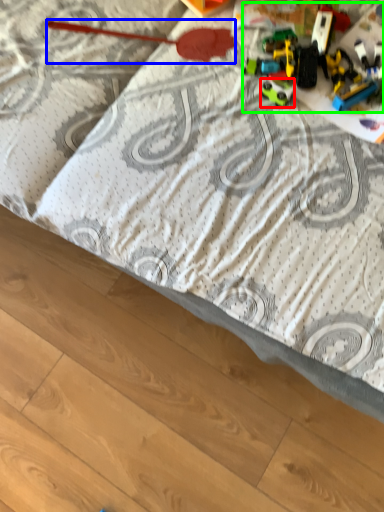
Question: Estimate the real-world distances between objects in this image. Which object is closer to toy (highlighted by a red box), toy (highlighted by a blue box) or toy (highlighted by a green box)?

Choices:
 (A) toy
 (B) toy

Answer: (B)